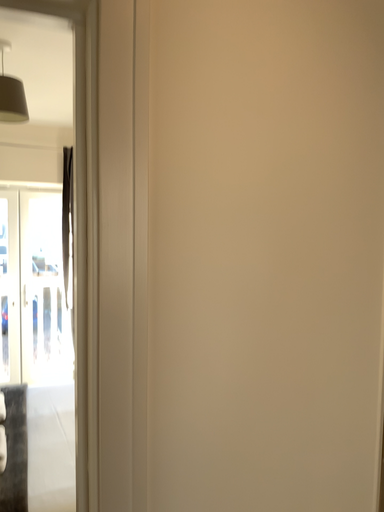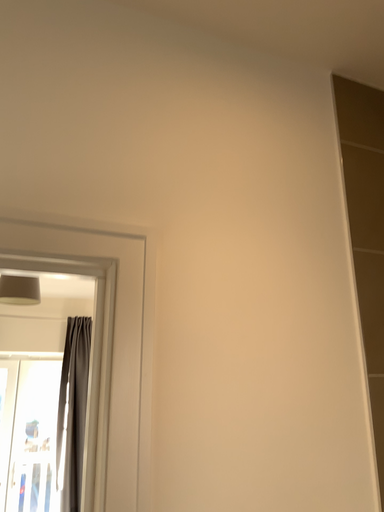
Question: Which way did the camera rotate in the video?

Choices:
 (A) rotated upward
 (B) rotated downward

Answer: (A)